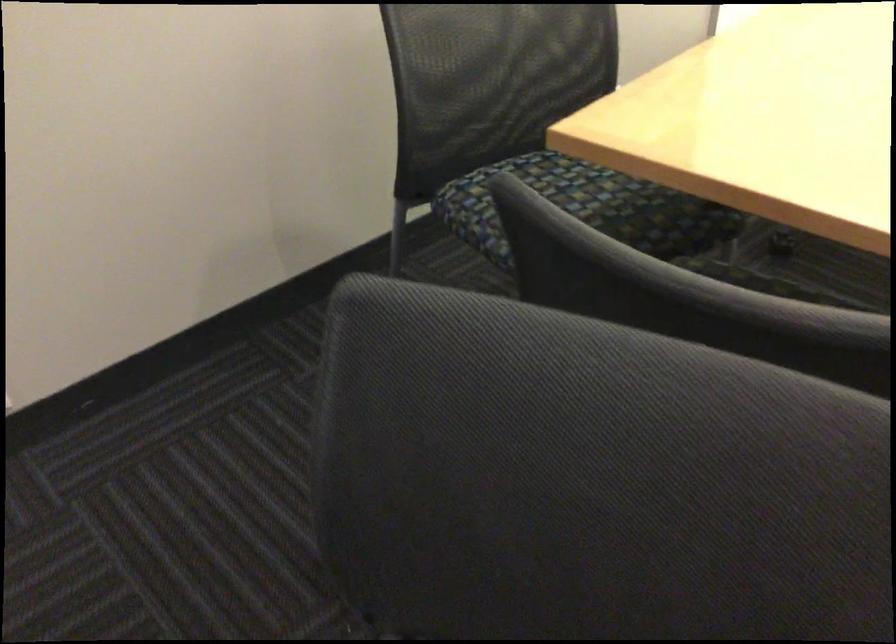
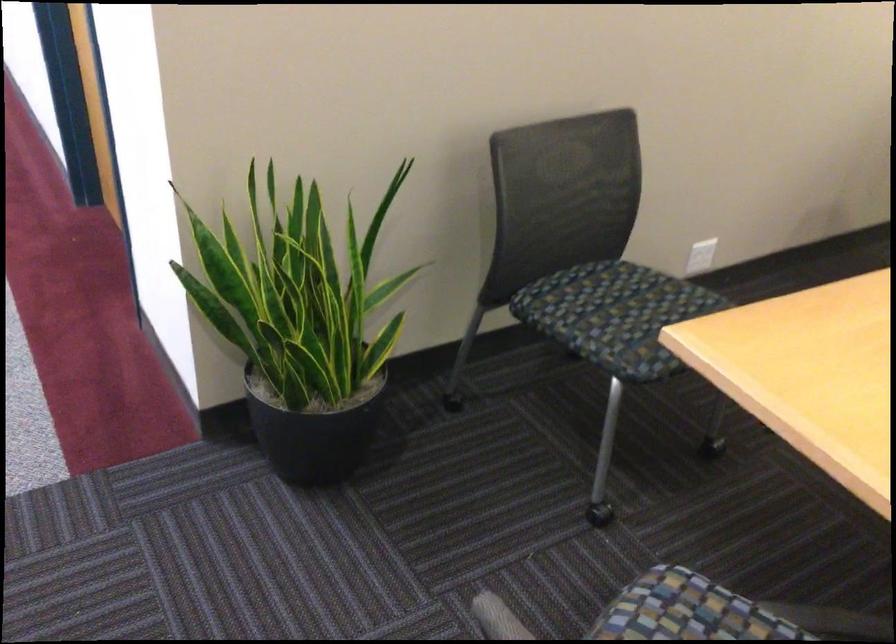
The images are taken continuously from a first-person perspective. In which direction are you moving?

The movement direction of the cameraman is left, backward.